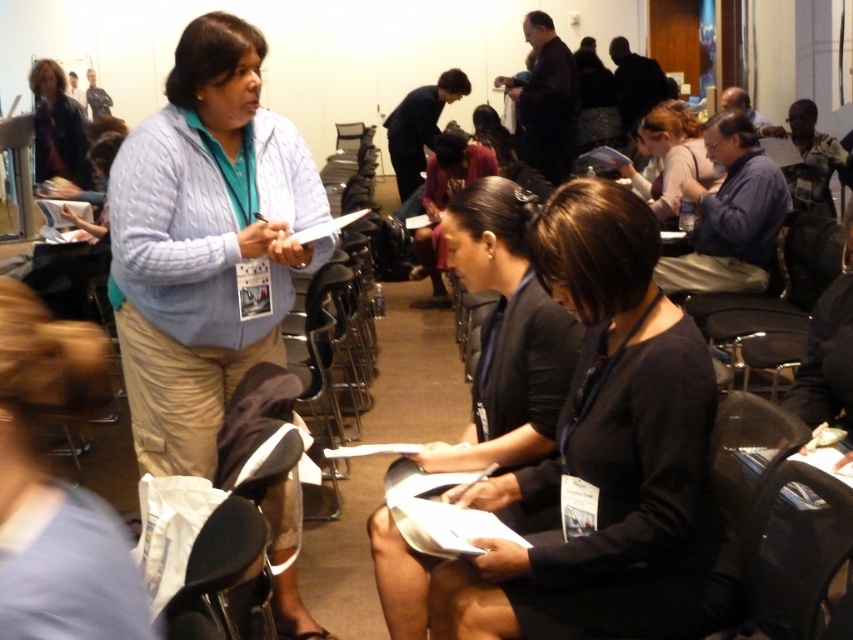
Question: Is matte black hair at upper right behind matte black jacket at upper left?

Choices:
 (A) no
 (B) yes

Answer: (A)

Question: Estimate the real-world distances between objects in this image. Which object is closer to the light blue knitted sweater at center?

Choices:
 (A) black fabric jacket at center
 (B) black fabric shirt at center
 (C) matte black jacket at upper left

Answer: (A)

Question: Among these objects, which one is farthest from the camera?

Choices:
 (A) black fabric shirt at center
 (B) light blue knitted sweater at center
 (C) black fabric jacket at center

Answer: (B)

Question: Is black fabric shirt at center positioned before light blue knitted sweater at center?

Choices:
 (A) no
 (B) yes

Answer: (B)

Question: Observing the image, what is the correct spatial positioning of matte black hair at upper right in reference to matte black jacket at upper left?

Choices:
 (A) below
 (B) above

Answer: (A)

Question: Which of the following is the closest to the observer?

Choices:
 (A) [x=518, y=308]
 (B) [x=570, y=214]
 (C) [x=647, y=184]
 (D) [x=183, y=278]

Answer: (B)